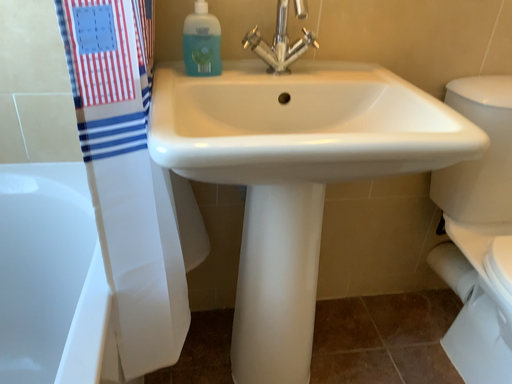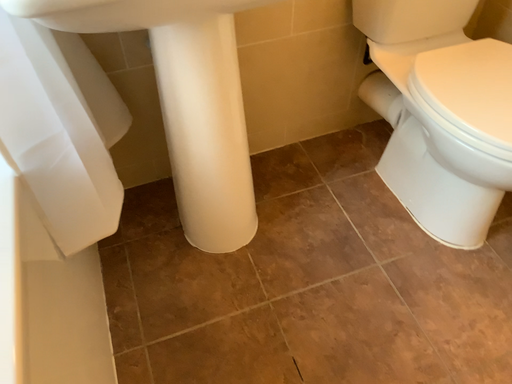
Question: How did the camera likely rotate when shooting the video?

Choices:
 (A) rotated upward
 (B) rotated downward

Answer: (B)